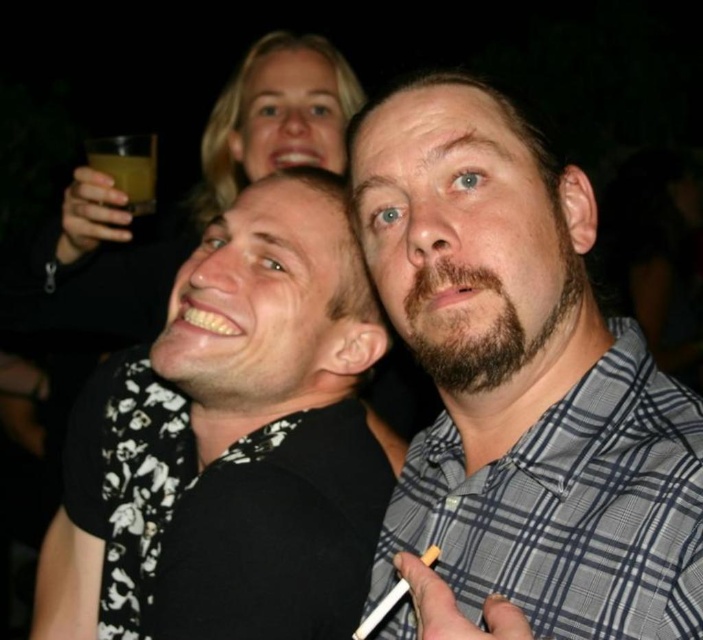
Image resolution: width=703 pixels, height=640 pixels. I want to click on gray checkered shirt at center, so click(520, 392).

Between point (449, 544) and point (278, 602), which one is positioned behind?

Point (278, 602)

At what (x,y) coordinates should I click in order to perform the action: click on gray checkered shirt at center. Please return your answer as a coordinate pair (x, y). The width and height of the screenshot is (703, 640). Looking at the image, I should click on (520, 392).

Is black floral shirt at center smaller than translucent amber liquid at upper left?

No.

Which of these two, black floral shirt at center or translucent amber liquid at upper left, stands shorter?

translucent amber liquid at upper left is shorter.

This screenshot has height=640, width=703. Identify the location of black floral shirt at center. (233, 444).

Does point (349, 157) come in front of point (146, 208)?

That is True.

Does gray checkered shirt at center appear over translucent amber liquid at upper left?

No, gray checkered shirt at center is not above translucent amber liquid at upper left.

Is point (619, 333) positioned after point (146, 189)?

That is False.

I want to click on gray checkered shirt at center, so click(520, 392).